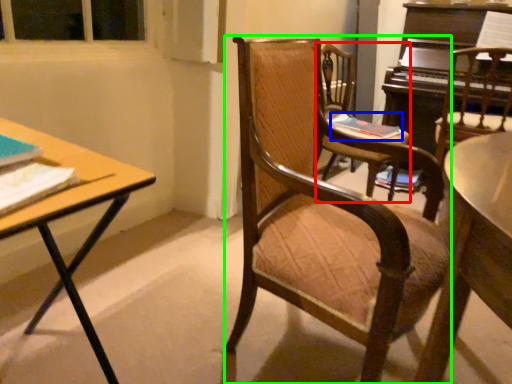
Question: Estimate the real-world distances between objects in this image. Which object is closer to chair (highlighted by a red box), book (highlighted by a blue box) or chair (highlighted by a green box)?

Choices:
 (A) book
 (B) chair

Answer: (A)